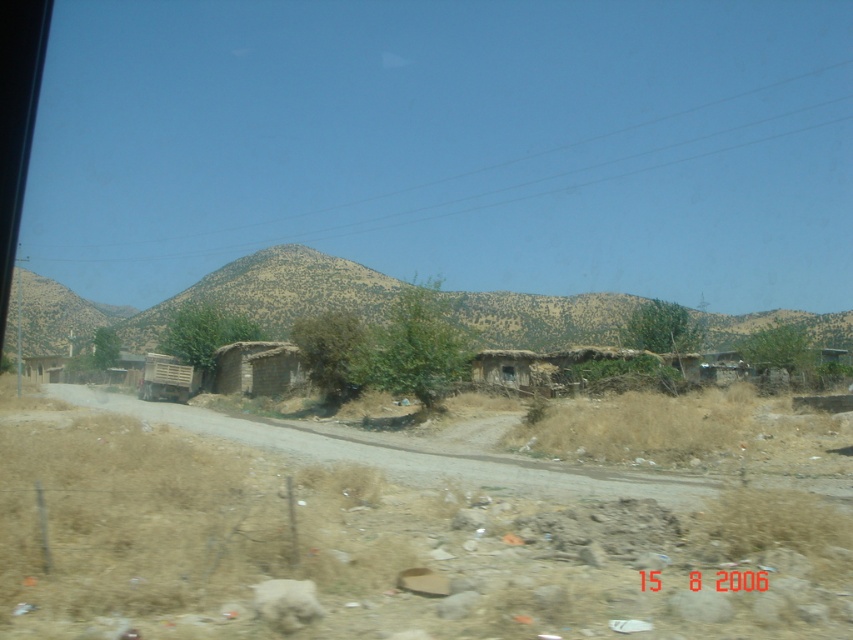
You are standing at the camera position and want to walk to both the point at coordinates [300,433] and the point at coordinates [268,392]. Which point will you reach first?

You will reach the point at coordinates [300,433] first because it is closer to the camera than the point at coordinates [268,392].

You are planning to take a photo of the brown textured mountain at center and the brown dirt track at center from a distance. Which object will appear bigger in the photo?

The brown textured mountain at center will appear bigger in the photo because it is larger in size than the brown dirt track at center.

Consider the image. You are standing at the edge of the brown dirt track at center and want to walk towards the brown textured mountain at center. Which direction should you head to reach the mountain?

The brown textured mountain at center is positioned over the brown dirt track at center, so you should head forward along the dirt track to reach the mountain.